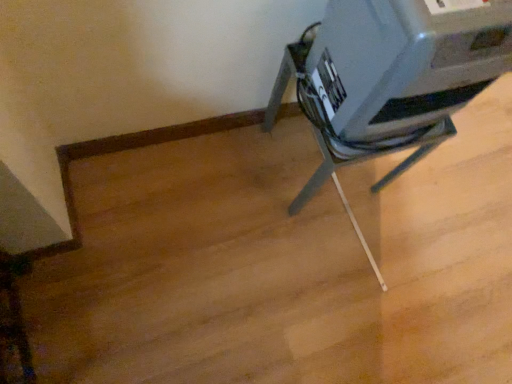
At what (x,y) coordinates should I click in order to perform the action: click on vacant region to the left of metallic gray printer at center. Please return your answer as a coordinate pair (x, y). Looking at the image, I should click on (229, 161).